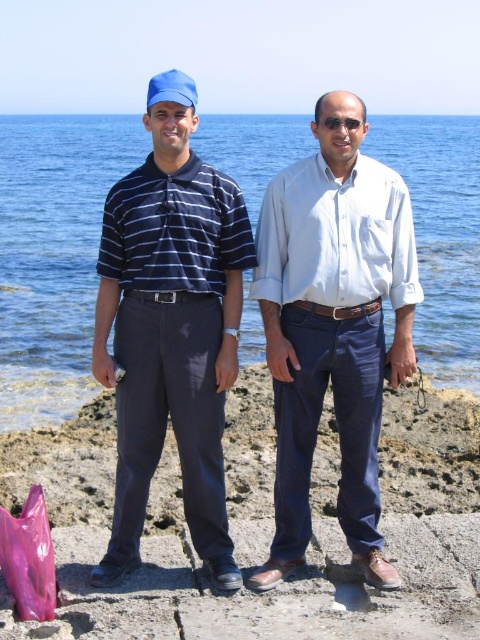
Question: Among these points, which one is farthest from the camera?

Choices:
 (A) (360, 307)
 (B) (419, 195)
 (C) (154, 349)

Answer: (B)

Question: Does clear blue water at center have a larger size compared to white cotton shirt at center?

Choices:
 (A) yes
 (B) no

Answer: (A)

Question: Which point is closer to the camera?

Choices:
 (A) (402, 204)
 (B) (300, 269)
 (C) (468, 369)
 (D) (136, 545)

Answer: (D)

Question: In this image, where is blue cotton shirt at center located relative to white cotton shirt at center?

Choices:
 (A) right
 (B) left

Answer: (B)

Question: Does clear blue water at center lie behind matte blue cap at center?

Choices:
 (A) no
 (B) yes

Answer: (B)

Question: Which object appears farthest from the camera in this image?

Choices:
 (A) white cotton shirt at center
 (B) clear blue water at center

Answer: (B)